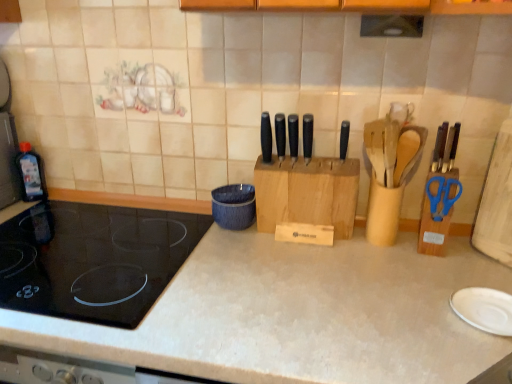
Question: Is black matte knife at center, which appears as the second knife when viewed from the right, located outside black matte knife at center, arranged as the first knife when viewed from the left?

Choices:
 (A) no
 (B) yes

Answer: (B)

Question: Can black matte knife at center, which appears as the 5th knife when viewed from the right, be found inside black matte knife at center, which is the fourth knife in left-to-right order?

Choices:
 (A) no
 (B) yes

Answer: (A)

Question: Does black matte knife at center, which appears as the second knife when viewed from the right, have a greater height compared to black matte knife at center, which appears as the 5th knife when viewed from the right?

Choices:
 (A) no
 (B) yes

Answer: (B)

Question: Can you confirm if black matte knife at center, which appears as the second knife when viewed from the right, is bigger than black matte knife at center, arranged as the first knife when viewed from the left?

Choices:
 (A) no
 (B) yes

Answer: (B)

Question: Is black matte knife at center, which appears as the second knife when viewed from the right, at the right side of black matte knife at center, arranged as the first knife when viewed from the left?

Choices:
 (A) yes
 (B) no

Answer: (A)

Question: From the image's perspective, is blue plastic scissors at right located above or below transparent plastic bottle at left?

Choices:
 (A) below
 (B) above

Answer: (A)

Question: From a real-world perspective, relative to transparent plastic bottle at left, is blue plastic scissors at right vertically above or below?

Choices:
 (A) below
 (B) above

Answer: (B)

Question: Is point (455, 182) closer or farther from the camera than point (37, 193)?

Choices:
 (A) farther
 (B) closer

Answer: (B)

Question: Is blue plastic scissors at right taller or shorter than transparent plastic bottle at left?

Choices:
 (A) short
 (B) tall

Answer: (A)

Question: Based on their positions, is black plastic knife at center, which is counted as the fourth knife, starting from the right, located to the left or right of black matte knife at center, the third knife positioned from the left?

Choices:
 (A) left
 (B) right

Answer: (A)

Question: Relative to black matte knife at center, the third knife positioned from the left, is black plastic knife at center, which is the 2th knife from left to right, in front or behind?

Choices:
 (A) front
 (B) behind

Answer: (B)

Question: Is black plastic knife at center, which is the 2th knife from left to right, spatially inside black matte knife at center, the third knife positioned from the left, or outside of it?

Choices:
 (A) inside
 (B) outside

Answer: (B)

Question: Looking at their shapes, would you say black plastic knife at center, which is the 2th knife from left to right, is wider or thinner than black matte knife at center, the third knife positioned from the left?

Choices:
 (A) thin
 (B) wide

Answer: (A)

Question: Is wooden knife block at center bigger or smaller than black matte knife at center, marked as the first knife in a right-to-left arrangement?

Choices:
 (A) big
 (B) small

Answer: (A)

Question: Would you say wooden knife block at center is to the left or to the right of black matte knife at center, arranged as the fifth knife when viewed from the left, in the picture?

Choices:
 (A) left
 (B) right

Answer: (A)